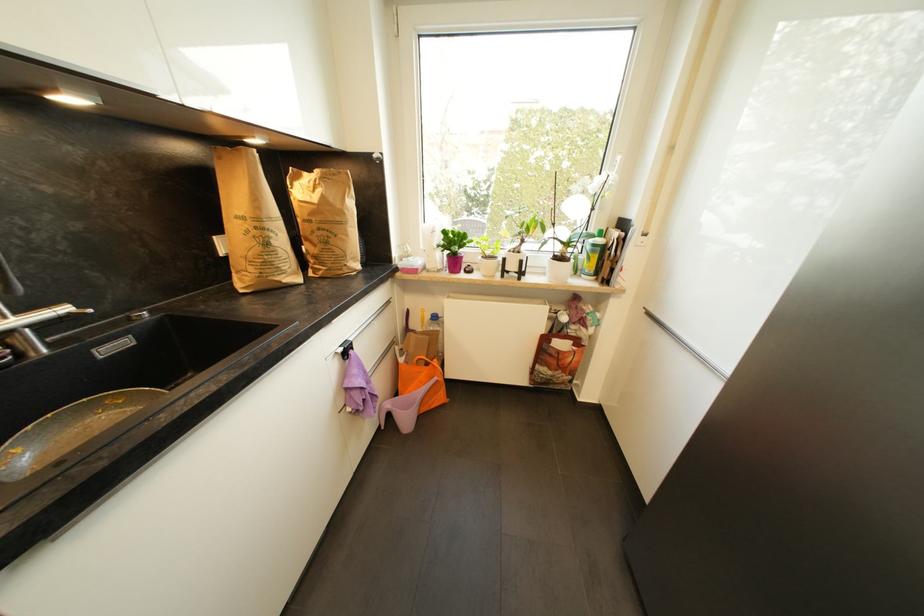
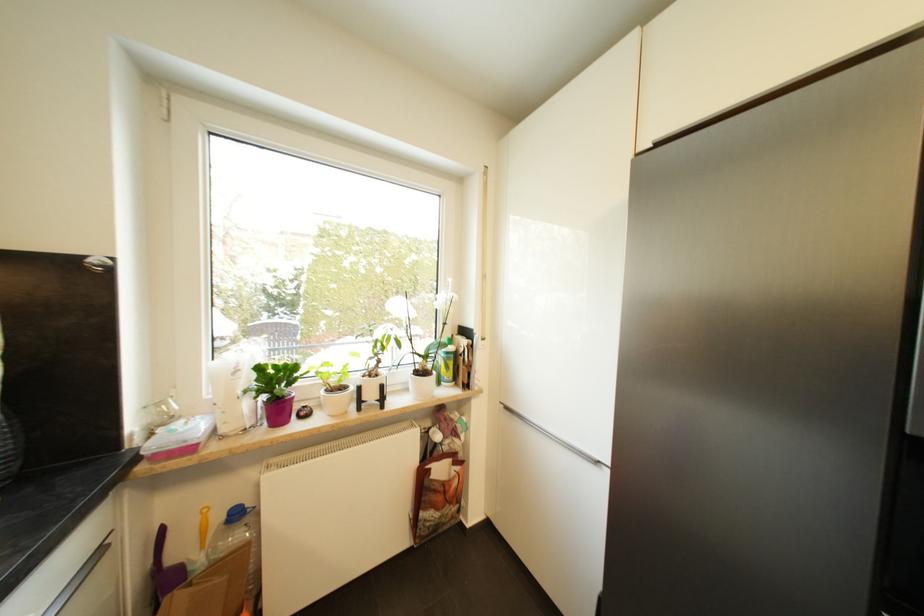
Locate, in the second image, the point that corresponds to (x=427, y=309) in the first image.

(207, 507)